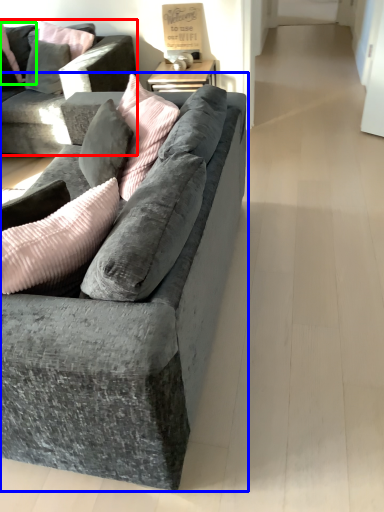
Question: Which object is the farthest from studio couch (highlighted by a red box)? Choose among these: studio couch (highlighted by a blue box) or pillow (highlighted by a green box).

Choices:
 (A) studio couch
 (B) pillow

Answer: (A)